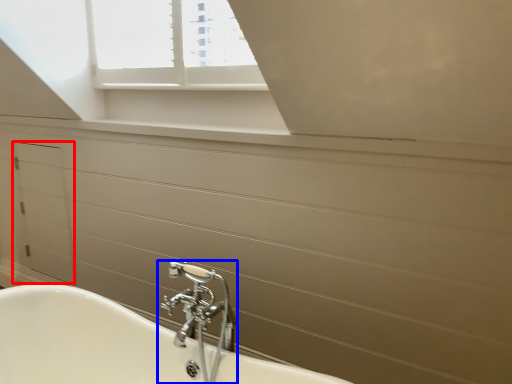
Question: Among these objects, which one is farthest to the camera, drawer (highlighted by a red box) or tap (highlighted by a blue box)?

Choices:
 (A) drawer
 (B) tap

Answer: (A)